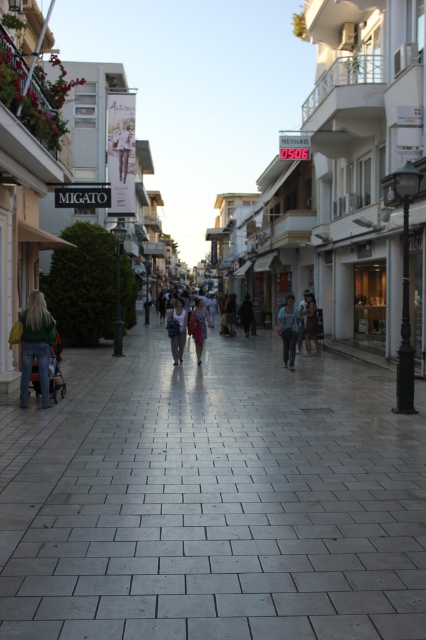
You are a delivery person trying to deliver a package to the dark gray coat at center. You see the denim pants at center blocking the path. Can you walk around them to reach your destination?

The denim pants at center is in front of the dark gray coat at center, so you can walk around the denim pants at center to reach the dark gray coat at center.